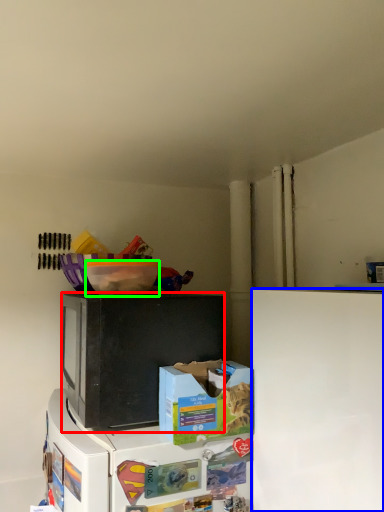
Question: Which object is positioned closest to microwave oven (highlighted by a red box)? Select from refrigerator (highlighted by a blue box) and bowl (highlighted by a green box).

Choices:
 (A) refrigerator
 (B) bowl

Answer: (B)